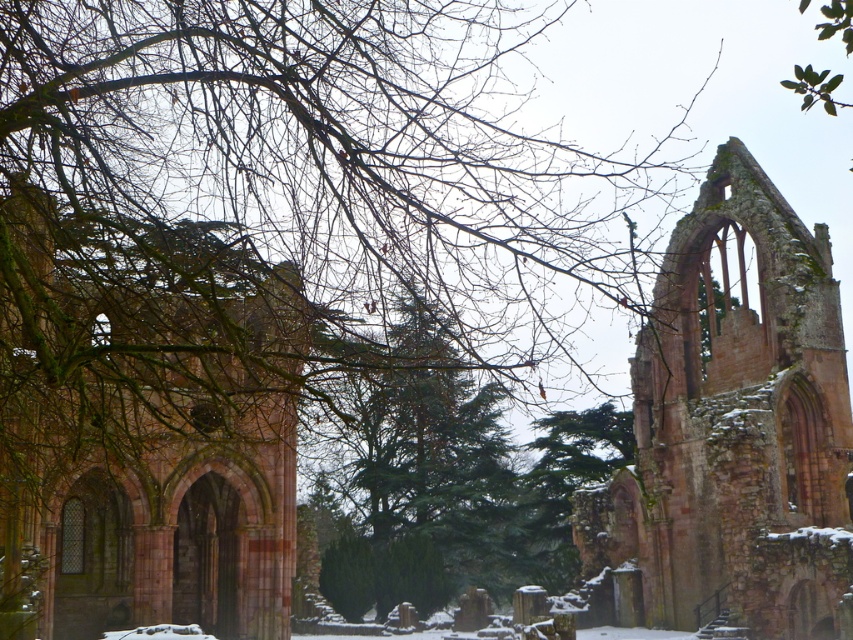
Question: Observing the image, what is the correct spatial positioning of rustic stone arches at center in reference to rustic stone ruins at center?

Choices:
 (A) left
 (B) right

Answer: (A)

Question: Which object is closer to the camera taking this photo?

Choices:
 (A) rustic stone ruins at center
 (B) rustic stone arches at center

Answer: (B)

Question: Which of the following is the farthest from the observer?

Choices:
 (A) (97, 340)
 (B) (824, 636)

Answer: (B)

Question: Can you confirm if rustic stone arches at center is thinner than rustic stone ruins at center?

Choices:
 (A) no
 (B) yes

Answer: (A)

Question: Among these objects, which one is nearest to the camera?

Choices:
 (A) rustic stone ruins at center
 (B) rustic stone arches at center

Answer: (B)

Question: Is rustic stone arches at center above rustic stone ruins at center?

Choices:
 (A) no
 (B) yes

Answer: (B)